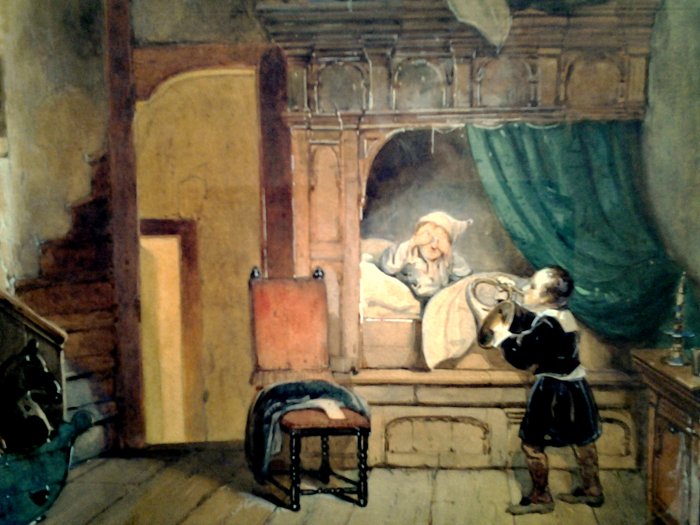
Locate an element on the screen. This screenshot has height=525, width=700. green curtain is located at coordinates (547, 196), (547, 494).